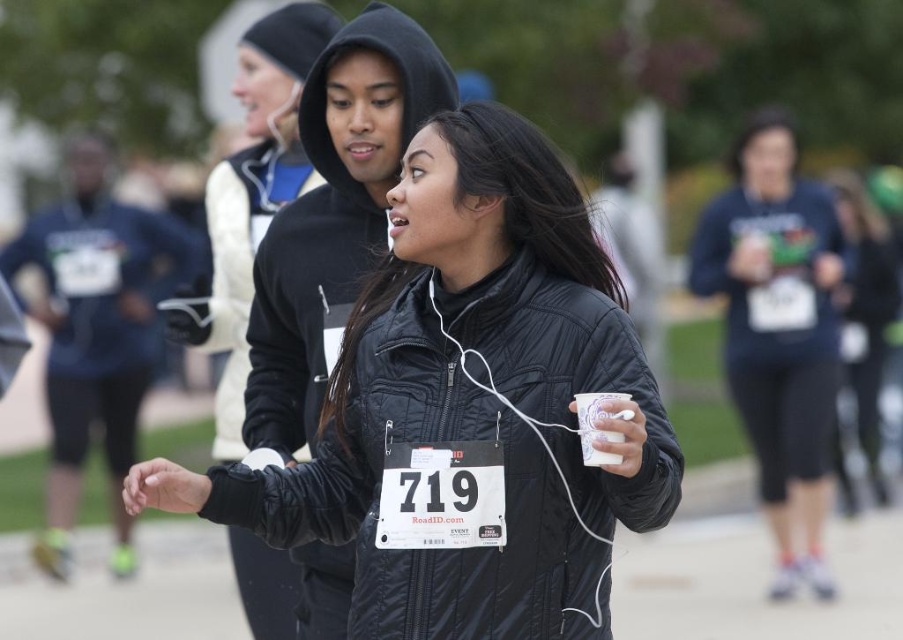
Question: Where is black quilted jacket at center located in relation to white paper cup at center in the image?

Choices:
 (A) right
 (B) left

Answer: (B)

Question: Is matte blue sweatshirt at center behind white paper cup at center?

Choices:
 (A) no
 (B) yes

Answer: (B)

Question: Among these objects, which one is nearest to the camera?

Choices:
 (A) white paper cup at center
 (B) black quilted jacket at center

Answer: (A)

Question: Does matte blue sweatshirt at center have a greater width compared to white paper cup at center?

Choices:
 (A) yes
 (B) no

Answer: (A)

Question: Among these objects, which one is nearest to the camera?

Choices:
 (A) white paper cup at center
 (B) matte blue sweatshirt at center

Answer: (A)

Question: Among these objects, which one is nearest to the camera?

Choices:
 (A) white paper cup at center
 (B) black quilted jacket at center
 (C) matte blue sweatshirt at center

Answer: (A)